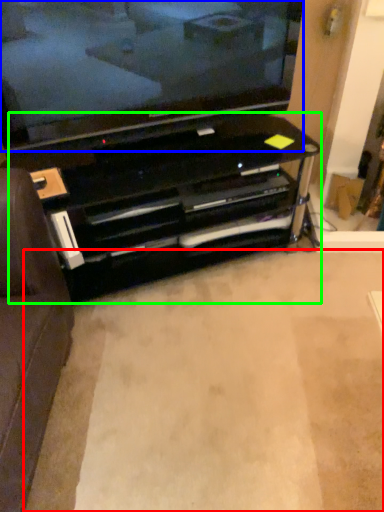
Question: Based on their relative distances, which object is nearer to plain (highlighted by a red box)? Choose from television (highlighted by a blue box) and entertainment center (highlighted by a green box).

Choices:
 (A) television
 (B) entertainment center

Answer: (B)